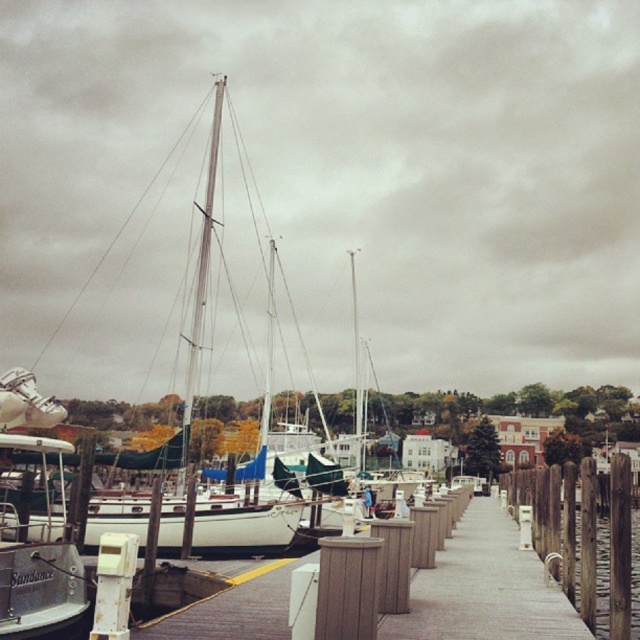
Does white matte sailboat at center appear on the right side of brushed metal boat at left?

Yes, white matte sailboat at center is to the right of brushed metal boat at left.

Between point (211, 184) and point (28, 371), which one is positioned in front?

Point (28, 371) is more forward.

What do you see at coordinates (230, 522) in the screenshot? The image size is (640, 640). I see `white matte sailboat at center` at bounding box center [230, 522].

At what (x,y) coordinates should I click in order to perform the action: click on white matte sailboat at center. Please return your answer as a coordinate pair (x, y). This screenshot has width=640, height=640. Looking at the image, I should click on (230, 522).